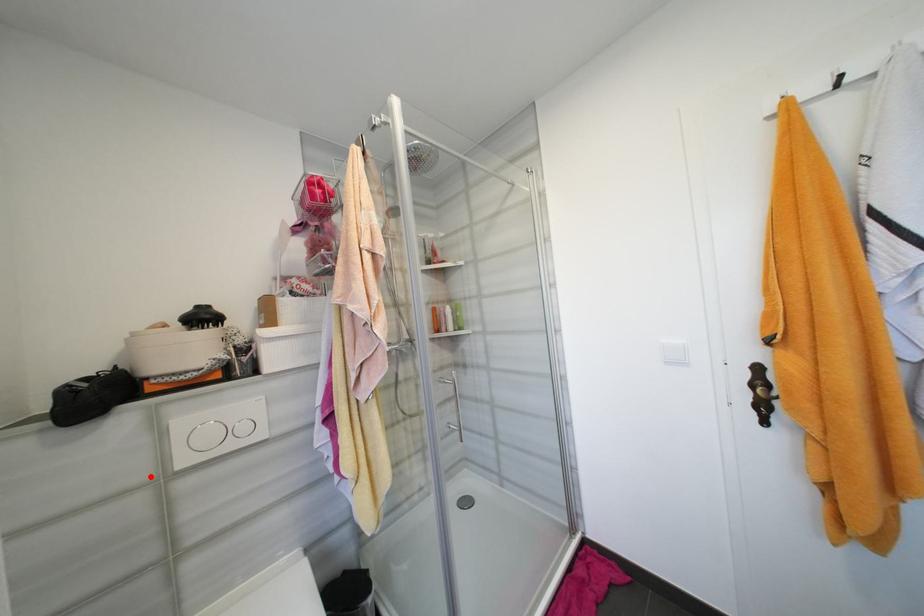
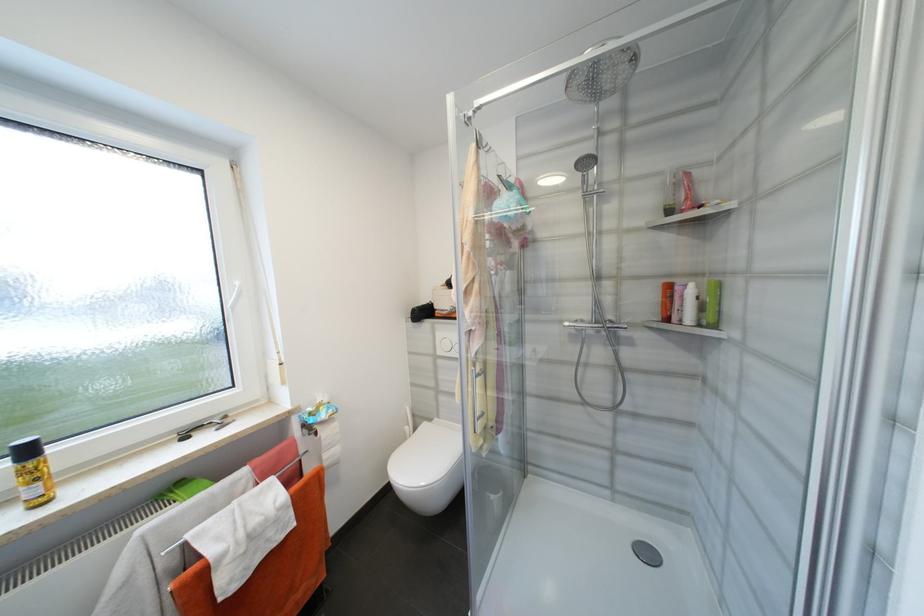
Where in the second image is the point corresponding to the highlighted location from the first image?

(436, 352)